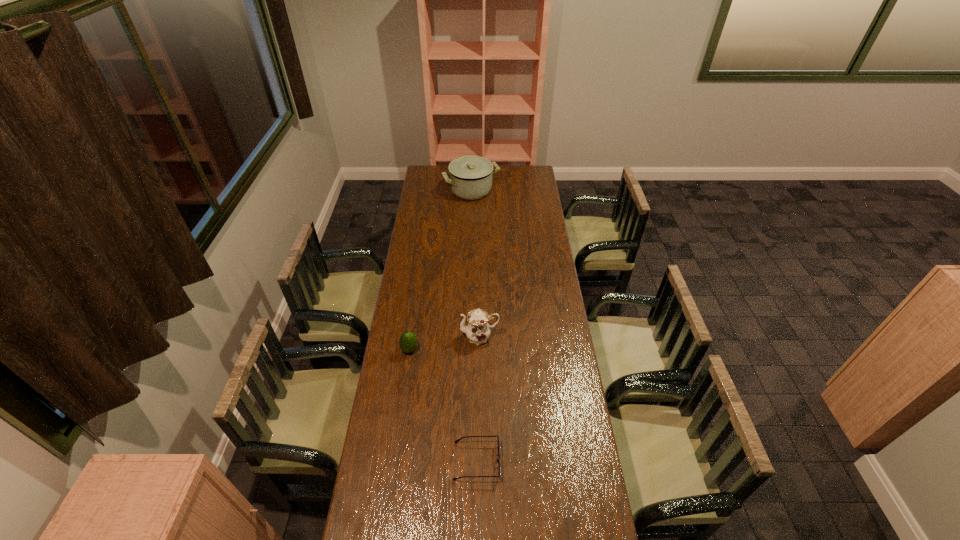
Find the location of `vacant area between the leftmost object and the chinaware`. vacant area between the leftmost object and the chinaware is located at coordinates (444, 343).

Locate an element on the screen. The height and width of the screenshot is (540, 960). empty location between the farthest object and the second shortest object is located at coordinates (441, 270).

The height and width of the screenshot is (540, 960). I want to click on vacant area between the farthest object and the avocado, so click(441, 270).

At what (x,y) coordinates should I click in order to perform the action: click on vacant space that is in between the chinaware and the saucepan. Please return your answer as a coordinate pair (x, y). This screenshot has height=540, width=960. Looking at the image, I should click on (475, 264).

You are a GUI agent. You are given a task and a screenshot of the screen. Output one action in this format:
    pyautogui.click(x=<x>, y=<y>)
    Task: Click on the free space that is in between the chinaware and the farthest object
    
    Given the screenshot: What is the action you would take?
    pyautogui.click(x=475, y=264)

This screenshot has width=960, height=540. What are the coordinates of `free area in between the avocado and the chinaware` in the screenshot? It's located at (444, 343).

This screenshot has width=960, height=540. Identify the location of unoccupied area between the chinaware and the farthest object. (475, 264).

This screenshot has height=540, width=960. What are the coordinates of `object that is the closest one to the farthest object` in the screenshot? It's located at (477, 330).

Identify the location of the second closest object relative to the shortest object. This screenshot has width=960, height=540. (477, 330).

Where is `vacant space that satisfies the following two spatial constraints: 1. on the back side of the leftmost object; 2. on the left side of the farthest object`? vacant space that satisfies the following two spatial constraints: 1. on the back side of the leftmost object; 2. on the left side of the farthest object is located at coordinates (432, 191).